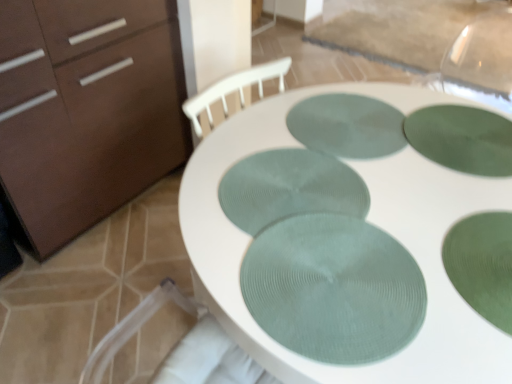
Question: Is green textured glass plate at center, placed as the fifth glass plate when sorted from back to front, at the right side of green textured glass plate at center, the 3th glass plate viewed from the back?

Choices:
 (A) yes
 (B) no

Answer: (A)

Question: Is green textured glass plate at center, the third glass plate when ordered from front to back, completely or partially inside green textured glass plate at center, placed as the fifth glass plate when sorted from back to front?

Choices:
 (A) yes
 (B) no

Answer: (B)

Question: From the image's perspective, is green textured glass plate at center, placed as the fifth glass plate when sorted from back to front, on green textured glass plate at center, the third glass plate when ordered from front to back?

Choices:
 (A) no
 (B) yes

Answer: (A)

Question: Considering the relative sizes of green textured glass plate at center, the first glass plate viewed from the front, and green textured glass plate at center, the 3th glass plate viewed from the back, in the image provided, is green textured glass plate at center, the first glass plate viewed from the front, bigger than green textured glass plate at center, the 3th glass plate viewed from the back,?

Choices:
 (A) no
 (B) yes

Answer: (B)

Question: Can you confirm if green textured glass plate at center, placed as the fifth glass plate when sorted from back to front, is taller than green textured glass plate at center, the third glass plate when ordered from front to back?

Choices:
 (A) no
 (B) yes

Answer: (B)

Question: Based on their sizes in the image, would you say green textured placemat at center, which is the fifth glass plate in front-to-back order, is bigger or smaller than green textured glass at center, acting as the second glass plate starting from the front?

Choices:
 (A) small
 (B) big

Answer: (B)

Question: Is green textured placemat at center, which is the fifth glass plate in front-to-back order, taller or shorter than green textured glass at center, positioned as the fourth glass plate in back-to-front order?

Choices:
 (A) short
 (B) tall

Answer: (A)

Question: Is green textured placemat at center, which is the fifth glass plate in front-to-back order, in front of or behind green textured glass at center, positioned as the fourth glass plate in back-to-front order, in the image?

Choices:
 (A) behind
 (B) front

Answer: (A)

Question: Considering the relative positions of green textured placemat at center, which is the 1th glass plate in back-to-front order, and green textured glass at center, acting as the second glass plate starting from the front, in the image provided, is green textured placemat at center, which is the 1th glass plate in back-to-front order, to the left or to the right of green textured glass at center, acting as the second glass plate starting from the front,?

Choices:
 (A) left
 (B) right

Answer: (A)

Question: Visually, is green textured glass plate at center, the first glass plate viewed from the front, positioned to the left or to the right of green textured glass plate at center, the third glass plate when ordered from front to back?

Choices:
 (A) right
 (B) left

Answer: (A)

Question: From a real-world perspective, is green textured glass plate at center, the first glass plate viewed from the front, positioned above or below green textured glass plate at center, the 3th glass plate viewed from the back?

Choices:
 (A) above
 (B) below

Answer: (A)

Question: Considering the positions of point coord(309,301) and point coord(361,183), is point coord(309,301) closer or farther from the camera than point coord(361,183)?

Choices:
 (A) closer
 (B) farther

Answer: (A)

Question: Relative to green textured glass plate at center, the 3th glass plate viewed from the back, is green textured glass plate at center, the first glass plate viewed from the front, in front or behind?

Choices:
 (A) front
 (B) behind

Answer: (A)

Question: Is white textured placemats at center inside or outside of matte brown cabinet at left?

Choices:
 (A) outside
 (B) inside

Answer: (A)

Question: Based on their sizes in the image, would you say white textured placemats at center is bigger or smaller than matte brown cabinet at left?

Choices:
 (A) big
 (B) small

Answer: (A)